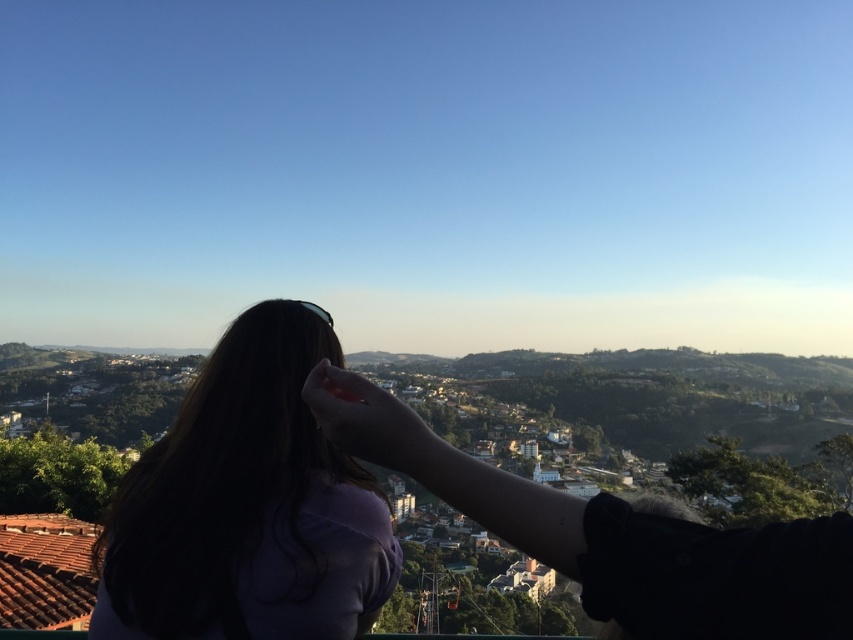
You are standing in the serene outdoor scene described. You notice a point marked at coordinates [247,506]. What object is located at this point?

The point at coordinates [247,506] corresponds to the dark purple shirt at center.

You are a photographer trying to capture a closeup of the dark purple shirt at center and the matte pink hand at center. Since you want both to be in focus, which one should you focus on first to ensure the other is also sharp?

The dark purple shirt at center is bigger than the matte pink hand at center, so you should focus on the dark purple shirt at center first to ensure both are in focus.